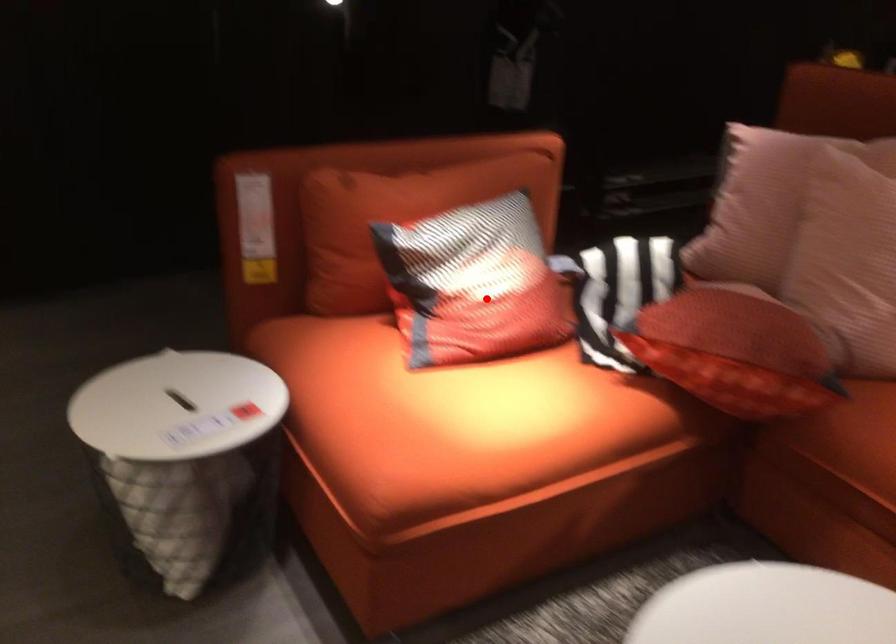
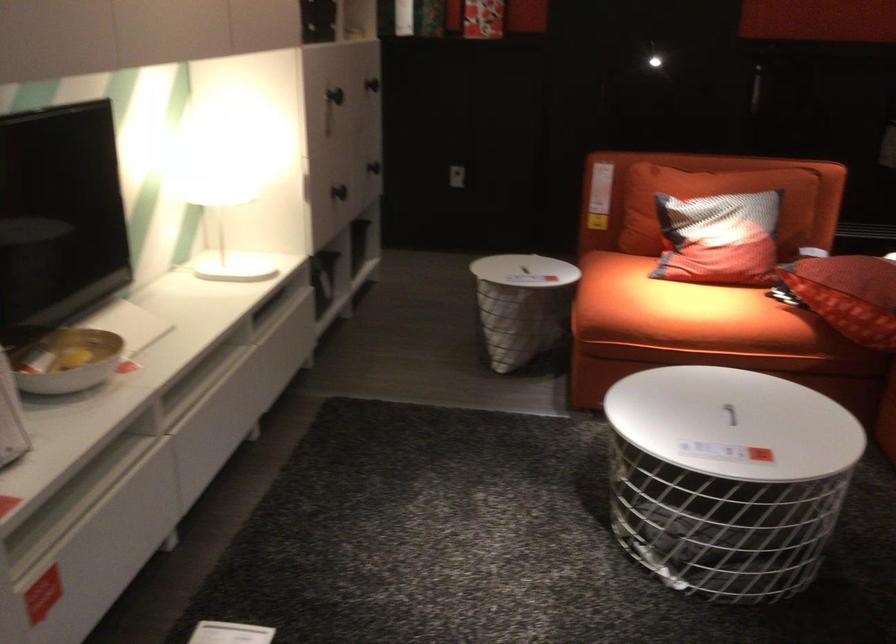
Question: I am providing you with two images of the same scene from different viewpoints. Image1 has a red point marked. In image2, the corresponding 3D location appears at what relative position? Reply with the corresponding letter.

Choices:
 (A) Closer
 (B) Farther

Answer: (B)